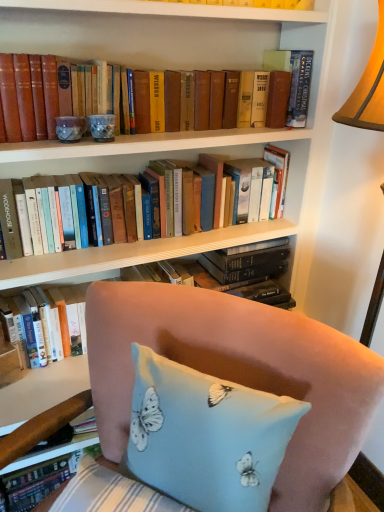
Question: Is hardcover book at upper right, the 3th book ordered from the bottom, taller or shorter than pink fabric chair at lower right?

Choices:
 (A) short
 (B) tall

Answer: (A)

Question: From a real-world perspective, is hardcover book at upper right, acting as the 1th book starting from the top, above or below pink fabric chair at lower right?

Choices:
 (A) above
 (B) below

Answer: (A)

Question: Which object is positioned farthest from the pink fabric chair at lower right?

Choices:
 (A) hardcover book at upper right, the 3th book ordered from the bottom
 (B) light blue fabric pillow with butterfly print at lower center
 (C) matte brown book at upper center, the 2th book positioned from the top
 (D) hardcover books at center, marked as the 3th book in a top-to-bottom arrangement

Answer: (A)

Question: Estimate the real-world distances between objects in this image. Which object is closer to the pink fabric chair at lower right?

Choices:
 (A) matte brown book at upper center, the 2th book positioned from the top
 (B) hardcover book at upper right, the 3th book ordered from the bottom
 (C) hardcover books at center, marked as the 3th book in a top-to-bottom arrangement
 (D) light blue fabric pillow with butterfly print at lower center

Answer: (C)